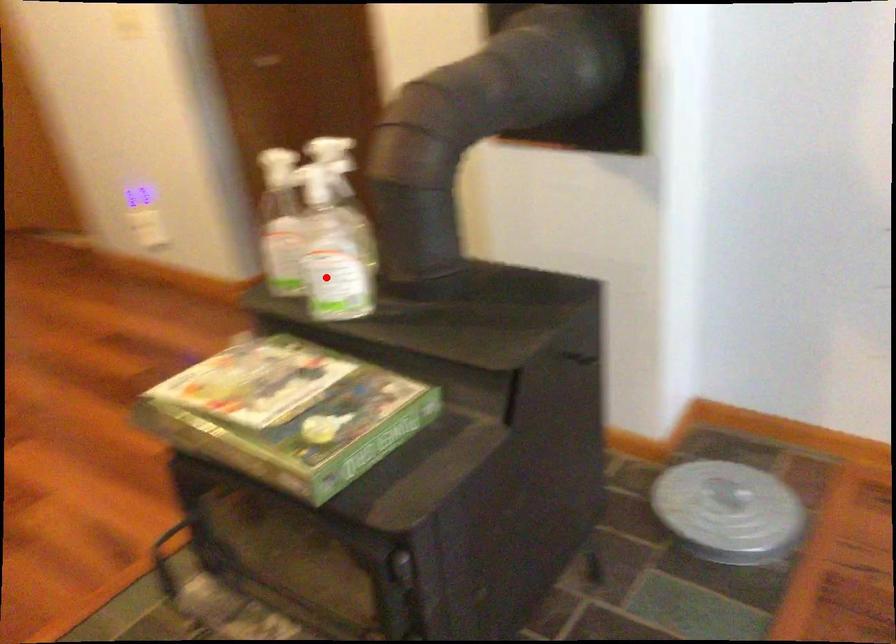
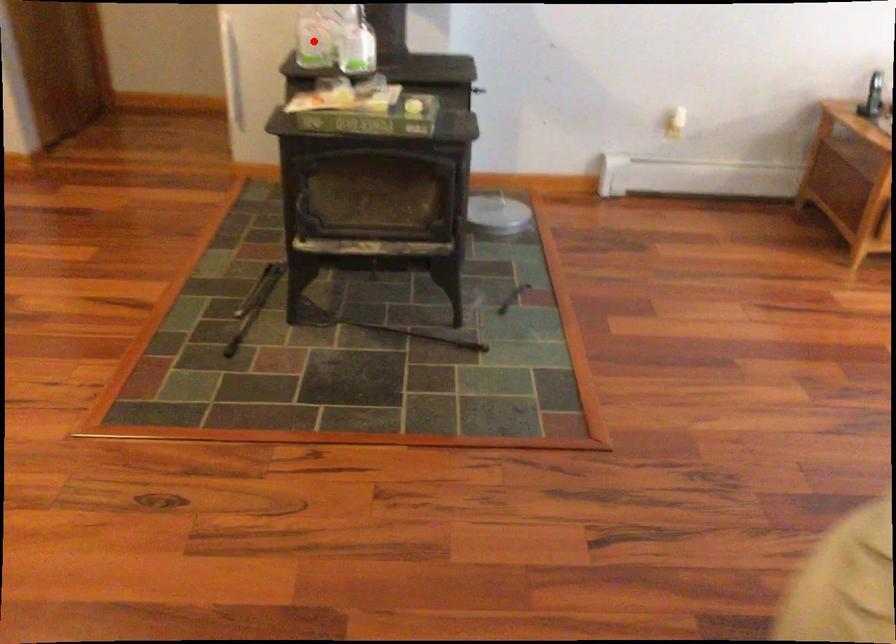
I am providing you with two images of the same scene from different viewpoints. A red point is marked on the first image and another point is marked on the second image. Are the points marked in image1 and image2 representing the same 3D position?

No